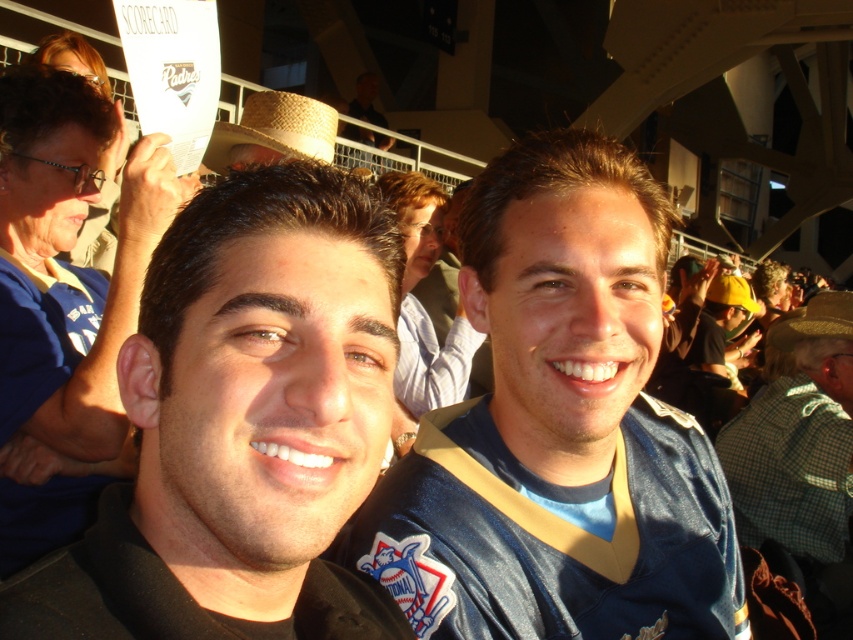
Does blue shiny jersey at center have a lesser width compared to strawhat at upper center?

No.

Does point (585, 356) lie in front of point (251, 99)?

That is True.

This screenshot has height=640, width=853. What do you see at coordinates (560, 429) in the screenshot?
I see `blue shiny jersey at center` at bounding box center [560, 429].

Identify the location of blue shiny jersey at center. The height and width of the screenshot is (640, 853). (560, 429).

Is point (560, 561) in front of point (167, 483)?

That is False.

Can you confirm if blue shiny jersey at center is wider than black jersey at center?

Correct, the width of blue shiny jersey at center exceeds that of black jersey at center.

Measure the distance between point (579, 420) and camera.

Point (579, 420) is 6.41 feet away from camera.

Locate an element on the screen. This screenshot has width=853, height=640. blue shiny jersey at center is located at coordinates (560, 429).

Between point (656, 406) and point (844, 310), which one is positioned behind?

Positioned behind is point (844, 310).

Can you confirm if blue shiny jersey at center is positioned below brown straw cowboy hat at center?

Yes, blue shiny jersey at center is below brown straw cowboy hat at center.

This screenshot has height=640, width=853. Describe the element at coordinates (560, 429) in the screenshot. I see `blue shiny jersey at center` at that location.

Identify the location of blue shiny jersey at center. This screenshot has width=853, height=640. (560, 429).